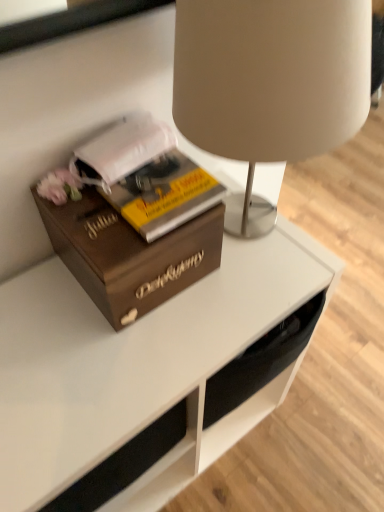
Describe the element at coordinates (126, 148) in the screenshot. This screenshot has width=384, height=512. I see `white matte book at left` at that location.

The height and width of the screenshot is (512, 384). What do you see at coordinates (129, 254) in the screenshot?
I see `wooden box at left` at bounding box center [129, 254].

The image size is (384, 512). Describe the element at coordinates (270, 85) in the screenshot. I see `matte beige lampshade at upper center` at that location.

Where is `white matte book at left`? white matte book at left is located at coordinates (126, 148).

Considering the points (113, 200) and (138, 132), which point is behind, point (113, 200) or point (138, 132)?

The point (138, 132) is farther from the camera.

Measure the distance from yellow matte book at center to white matte book at left.

yellow matte book at center is 2.57 inches away from white matte book at left.

From a real-world perspective, is yellow matte book at center physically located above or below white matte book at left?

From a real-world perspective, yellow matte book at center is physically below white matte book at left.

In the image, there is a white matte book at left. Where is `paperback book below it (from a real-world perspective)`? The width and height of the screenshot is (384, 512). paperback book below it (from a real-world perspective) is located at coordinates (164, 194).

Considering the positions of objects matte beige lampshade at upper center and yellow matte book at center in the image provided, who is more to the right, matte beige lampshade at upper center or yellow matte book at center?

matte beige lampshade at upper center is more to the right.

Which is closer, (187,42) or (199,174)?

Point (187,42).

From a real-world perspective, which is physically below, matte beige lampshade at upper center or yellow matte book at center?

From a 3D spatial view, yellow matte book at center is below.

Considering the relative sizes of matte beige lampshade at upper center and yellow matte book at center in the image provided, is matte beige lampshade at upper center shorter than yellow matte book at center?

No, matte beige lampshade at upper center is not shorter than yellow matte book at center.

From the image's perspective, is matte beige lampshade at upper center located above or below white matte book at left?

From the image's perspective, matte beige lampshade at upper center appears above white matte book at left.

Does point (197, 2) appear closer or farther from the camera than point (162, 147)?

Point (197, 2).

Is there a large distance between matte beige lampshade at upper center and white matte book at left?

They are positioned close to each other.

Is matte beige lampshade at upper center facing towards white matte book at left?

No, matte beige lampshade at upper center does not turn towards white matte book at left.

Is wooden box at left taller than matte beige lampshade at upper center?

In fact, wooden box at left may be shorter than matte beige lampshade at upper center.

Is wooden box at left aimed at matte beige lampshade at upper center?

No.

From a real-world perspective, which object stands above the other?

In real-world perspective, matte beige lampshade at upper center is above.

Which point is more distant from viewer, (175, 239) or (187, 115)?

Positioned behind is point (175, 239).

Would you say white matte book at left is inside or outside yellow matte book at center?

white matte book at left lies within the bounds of yellow matte book at center.

From a real-world perspective, relative to yellow matte book at center, is white matte book at left vertically above or below?

white matte book at left is situated higher than yellow matte book at center in the real world.

Which object is closer to the camera taking this photo, white matte book at left or yellow matte book at center?

yellow matte book at center is closer to the camera.

Considering the relative sizes of white matte book at left and yellow matte book at center in the image provided, is white matte book at left bigger than yellow matte book at center?

Indeed, white matte book at left has a larger size compared to yellow matte book at center.

Considering the sizes of objects wooden box at left and white matte book at left in the image provided, who is shorter, wooden box at left or white matte book at left?

With less height is white matte book at left.

Does wooden box at left turn towards white matte book at left?

No, wooden box at left is not aimed at white matte book at left.

Based on the photo, which object is wider, wooden box at left or white matte book at left?

wooden box at left is wider.

Considering the relative sizes of wooden box at left and white matte book at left in the image provided, is wooden box at left bigger than white matte book at left?

Correct, wooden box at left is larger in size than white matte book at left.

Is white matte book at left surrounding wooden box at left?

Actually, wooden box at left is outside white matte book at left.

What are the coordinates of `book behind the wooden box at left` in the screenshot? It's located at (126, 148).

Can you confirm if white matte book at left is wider than wooden box at left?

No, white matte book at left is not wider than wooden box at left.

Consider the image. From the image's perspective, who appears lower, white matte book at left or wooden box at left?

wooden box at left.

Find the location of `paperback book that is under the white matte book at left (from a real-world perspective)`. paperback book that is under the white matte book at left (from a real-world perspective) is located at coordinates (164, 194).

This screenshot has height=512, width=384. I want to click on paperback book on the left of the matte beige lampshade at upper center, so click(x=164, y=194).

From the image, which object appears to be farther from white matte book at left, yellow matte book at center or wooden box at left?

Based on the image, wooden box at left appears to be further to white matte book at left.

When comparing their distances from matte beige lampshade at upper center, does wooden box at left or yellow matte book at center seem closer?

Among the two, yellow matte book at center is located nearer to matte beige lampshade at upper center.

Based on their spatial positions, is yellow matte book at center or white matte book at left closer to matte beige lampshade at upper center?

Among the two, yellow matte book at center is located nearer to matte beige lampshade at upper center.

Looking at the image, which one is located closer to wooden box at left, white matte book at left or yellow matte book at center?

yellow matte book at center lies closer to wooden box at left than the other object.

From the image, which object appears to be farther from yellow matte book at center, wooden box at left or white matte book at left?

wooden box at left is further to yellow matte book at center.

Based on their spatial positions, is yellow matte book at center or wooden box at left further from matte beige lampshade at upper center?

Among the two, wooden box at left is located further to matte beige lampshade at upper center.

Looking at the image, which one is located further to white matte book at left, matte beige lampshade at upper center or yellow matte book at center?

matte beige lampshade at upper center is positioned further to the anchor white matte book at left.

Based on their spatial positions, is white matte book at left or wooden box at left closer to yellow matte book at center?

white matte book at left lies closer to yellow matte book at center than the other object.

In order to click on paperback book between white matte book at left and wooden box at left from top to bottom in this screenshot , I will do tap(164, 194).

Find the location of a particular element. paperback book between white matte book at left and matte beige lampshade at upper center is located at coordinates (164, 194).

I want to click on box between white matte book at left and matte beige lampshade at upper center, so click(129, 254).

Locate an element on the screen. Image resolution: width=384 pixels, height=512 pixels. paperback book between wooden box at left and matte beige lampshade at upper center in the horizontal direction is located at coordinates (164, 194).